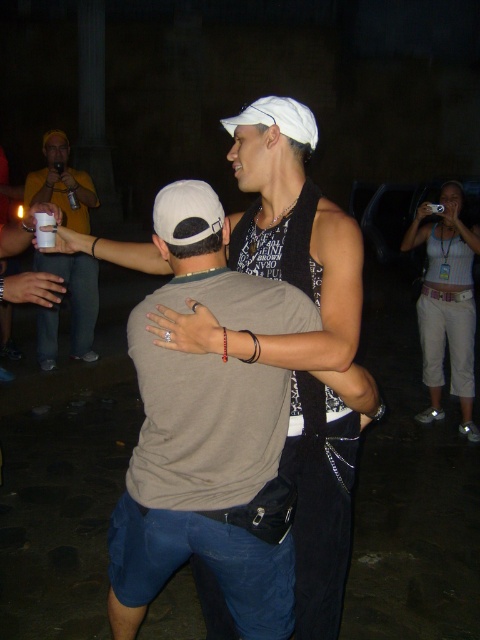
Question: Observing the image, what is the correct spatial positioning of white matte cap at center in reference to matte yellow shirt at left?

Choices:
 (A) left
 (B) right

Answer: (B)

Question: Estimate the real-world distances between objects in this image. Which object is farther from the white cotton tank top at upper right?

Choices:
 (A) matte yellow shirt at left
 (B) white matte cap at center

Answer: (B)

Question: Which of the following is the farthest from the observer?

Choices:
 (A) (423, 305)
 (B) (275, 106)
 (C) (82, 173)

Answer: (C)

Question: Does white cotton tank top at upper right have a larger size compared to matte yellow shirt at left?

Choices:
 (A) yes
 (B) no

Answer: (A)

Question: Observing the image, what is the correct spatial positioning of white matte cap at center in reference to white cotton tank top at upper right?

Choices:
 (A) below
 (B) above

Answer: (A)

Question: Which point appears closest to the camera in this image?

Choices:
 (A) (247, 136)
 (B) (43, 257)
 (C) (443, 246)

Answer: (A)